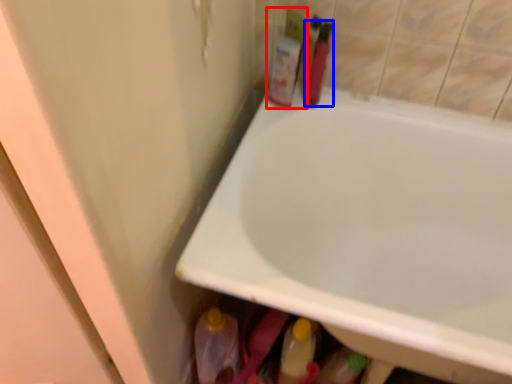
Question: Which of the following is the farthest to the observer, toiletry (highlighted by a red box) or toiletry (highlighted by a blue box)?

Choices:
 (A) toiletry
 (B) toiletry

Answer: (A)